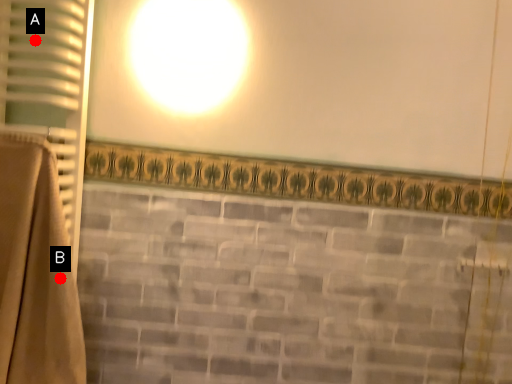
Question: Two points are circled on the image, labeled by A and B beside each circle. Which point is closer to the camera taking this photo?

Choices:
 (A) A is closer
 (B) B is closer

Answer: (B)